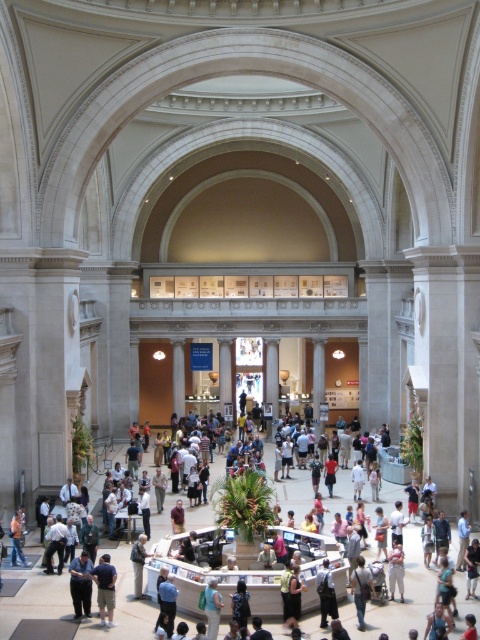
Question: Among these objects, which one is nearest to the camera?

Choices:
 (A) denim pants at center
 (B) light brown leather jacket at center

Answer: (B)

Question: Which of the following is the farthest from the observer?

Choices:
 (A) denim pants at center
 (B) khaki shorts at lower left
 (C) light blue jeans at center
 (D) light brown leather jacket at center

Answer: (A)

Question: Among these objects, which one is nearest to the camera?

Choices:
 (A) light blue jeans at center
 (B) light blue fabric shirt at center
 (C) dark gray shirt at center
 (D) khaki shorts at lower left

Answer: (B)

Question: Does light blue jeans at center lie behind light blue fabric shirt at center?

Choices:
 (A) yes
 (B) no

Answer: (A)

Question: Where is denim pants at center located in relation to light blue jeans at center in the image?

Choices:
 (A) right
 (B) left

Answer: (A)

Question: Does light brown leather jacket at center have a larger size compared to denim pants at center?

Choices:
 (A) yes
 (B) no

Answer: (A)